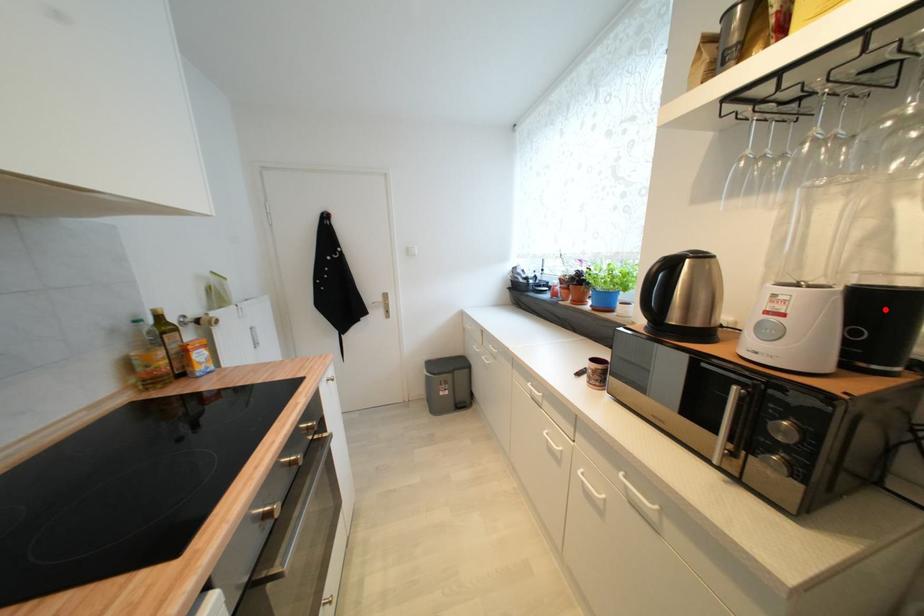
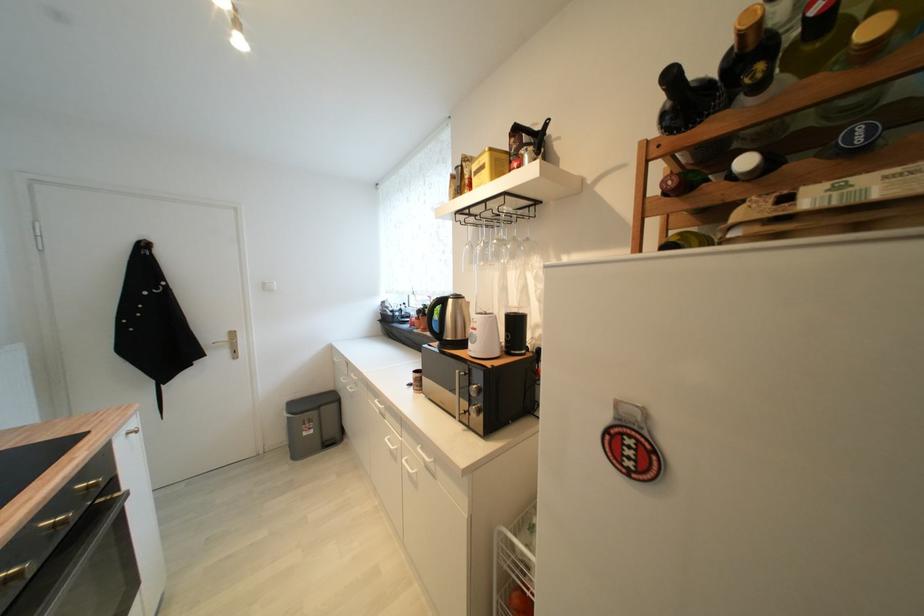
In the second image, find the point that corresponds to the highlighted location in the first image.

(521, 325)